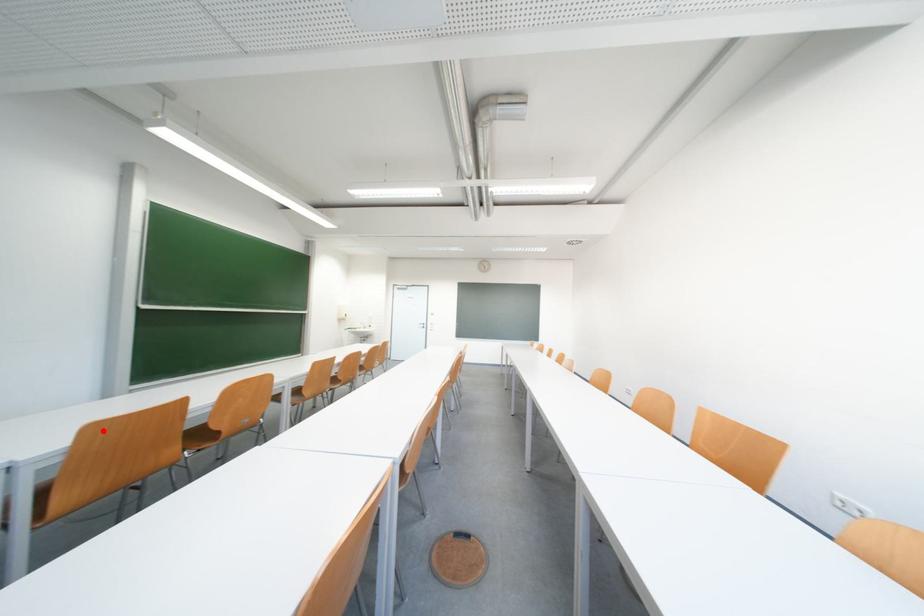
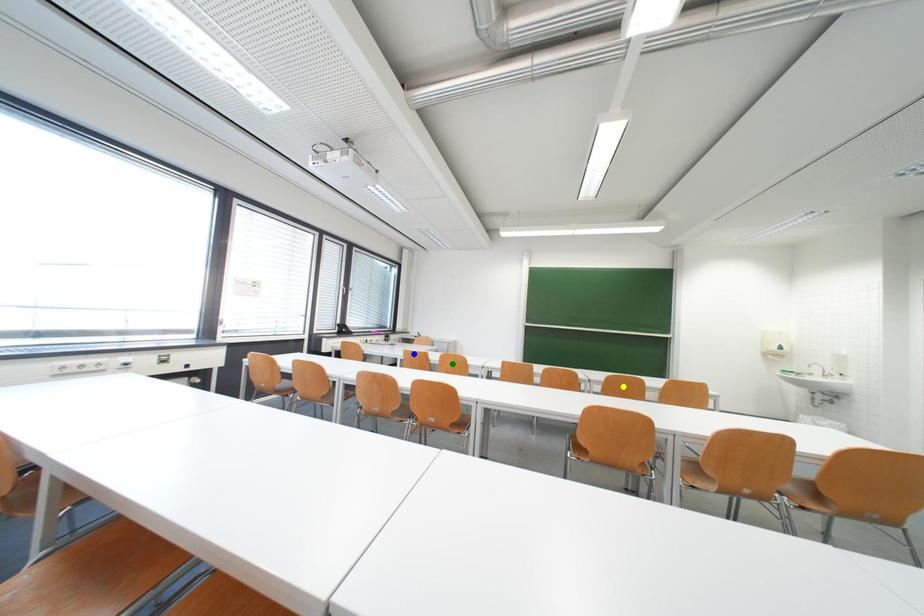
Question: I am providing you with two images of the same scene from different viewpoints. A red point is marked on the first image. You are given multiple points on the second image. Which spot in image 2 lines up with the point in image 1?

Choices:
 (A) blue point
 (B) green point
 (C) yellow point

Answer: (A)